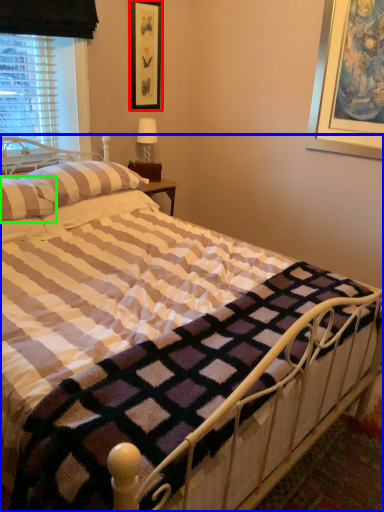
Question: Considering the real-world distances, which object is closest to picture frame (highlighted by a red box)? bed (highlighted by a blue box) or pillow (highlighted by a green box).

Choices:
 (A) bed
 (B) pillow

Answer: (B)